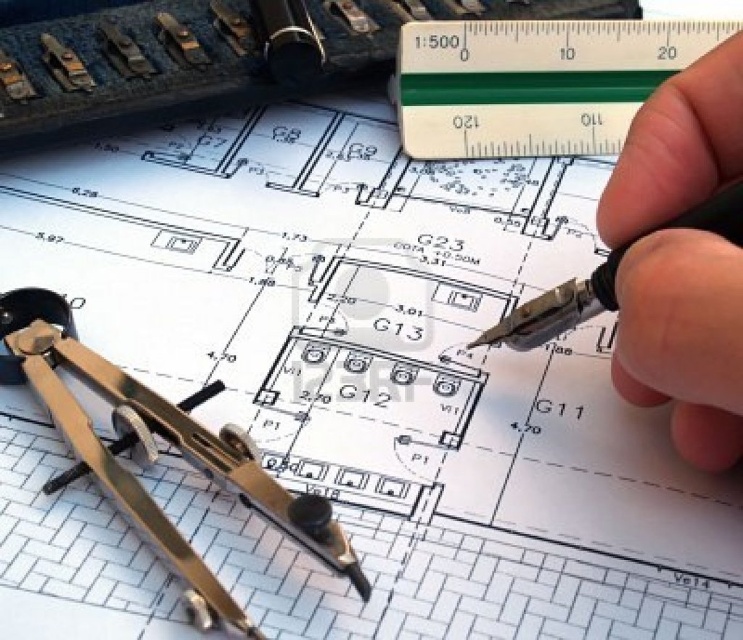
Who is higher up, metallic compass at lower left or metallic pen at center?

Positioned higher is metallic pen at center.

Who is more forward, (328, 545) or (571, 307)?

Point (328, 545) is in front.

Where is `metallic compass at lower left`? metallic compass at lower left is located at coordinates (155, 452).

Is transparent plastic ruler at upper center thinner than metallic pen at center?

No, transparent plastic ruler at upper center is not thinner than metallic pen at center.

Is transparent plastic ruler at upper center shorter than metallic pen at center?

No.

What do you see at coordinates (535, 83) in the screenshot? The image size is (743, 640). I see `transparent plastic ruler at upper center` at bounding box center [535, 83].

Identify the location of transparent plastic ruler at upper center. (535, 83).

Does black pen at upper right appear on the left side of transparent plastic ruler at upper center?

Correct, you'll find black pen at upper right to the left of transparent plastic ruler at upper center.

Is point (718, 161) behind point (484, 147)?

No, (718, 161) is in front of (484, 147).

Is point (614, 385) positioned before point (551, 38)?

Yes, it is in front of point (551, 38).

I want to click on black pen at upper right, so click(x=684, y=340).